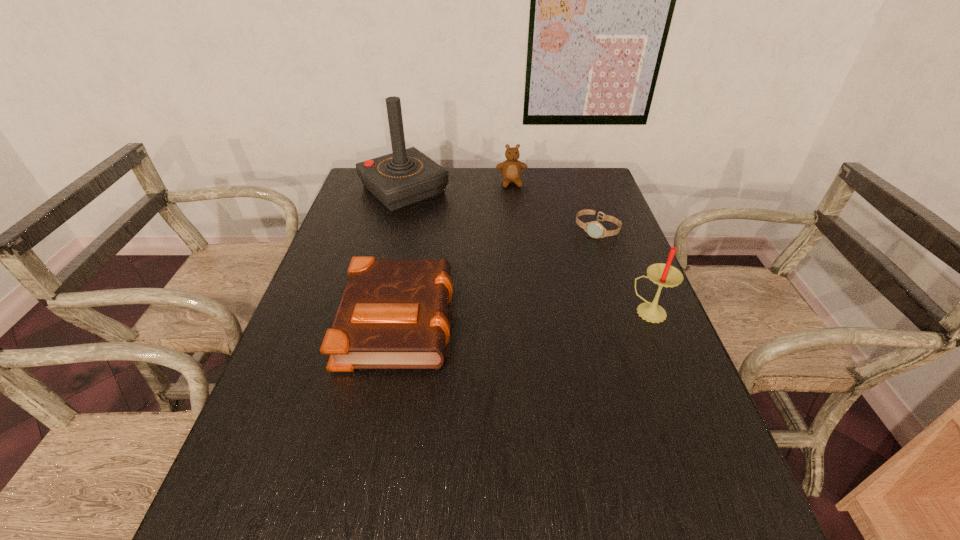
Where is `free space located on the front-facing side of the third shortest object`? This screenshot has height=540, width=960. free space located on the front-facing side of the third shortest object is located at coordinates (524, 241).

You are a GUI agent. You are given a task and a screenshot of the screen. Output one action in this format:
    pyautogui.click(x=<x>, y=<y>)
    Task: Click on the free spot located 0.210m on the front-facing side of the third shortest object
    The width and height of the screenshot is (960, 540).
    Given the screenshot: What is the action you would take?
    pos(520,222)

Where is `vacant space located on the face of the shortest object`? The image size is (960, 540). vacant space located on the face of the shortest object is located at coordinates (568, 261).

The height and width of the screenshot is (540, 960). I want to click on blank space located on the face of the shortest object, so click(528, 309).

Locate an element on the screen. The width and height of the screenshot is (960, 540). vacant area located 0.360m on the face of the shortest object is located at coordinates (528, 309).

Where is `free space located 0.080m on the rectangular base of the joystick`? This screenshot has height=540, width=960. free space located 0.080m on the rectangular base of the joystick is located at coordinates click(x=441, y=220).

Where is `blank area located on the rectangular base of the joystick`? blank area located on the rectangular base of the joystick is located at coordinates (490, 262).

Locate an element on the screen. The width and height of the screenshot is (960, 540). free space located on the rectangular base of the joystick is located at coordinates (436, 217).

The image size is (960, 540). What are the coordinates of `teddy bear that is positioned at the far edge` in the screenshot? It's located at (511, 169).

At what (x,y) coordinates should I click in order to perform the action: click on joystick that is at the far edge. Please return your answer as a coordinate pair (x, y). Looking at the image, I should click on (405, 177).